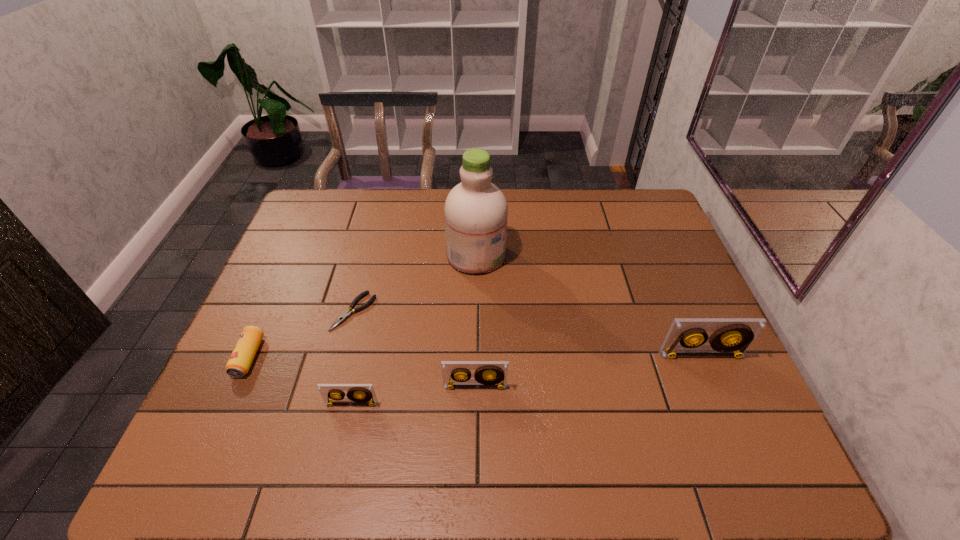
This screenshot has width=960, height=540. I want to click on the shortest videotape, so click(x=361, y=394).

Identify the location of the nearest videotape. (361, 394).

I want to click on the fifth farthest object, so click(488, 374).

Locate an element on the screen. This screenshot has height=540, width=960. the fourth shortest object is located at coordinates (488, 374).

Image resolution: width=960 pixels, height=540 pixels. Find the location of `the tallest videotape`. the tallest videotape is located at coordinates (732, 337).

Locate an element on the screen. The image size is (960, 540). the second tallest object is located at coordinates (732, 337).

Where is `cleansing agent`? This screenshot has width=960, height=540. cleansing agent is located at coordinates (476, 211).

The image size is (960, 540). Find the location of `the tallest object`. the tallest object is located at coordinates (476, 211).

The width and height of the screenshot is (960, 540). I want to click on pliers, so click(x=349, y=312).

This screenshot has height=540, width=960. Identify the location of the shortest object. (349, 312).